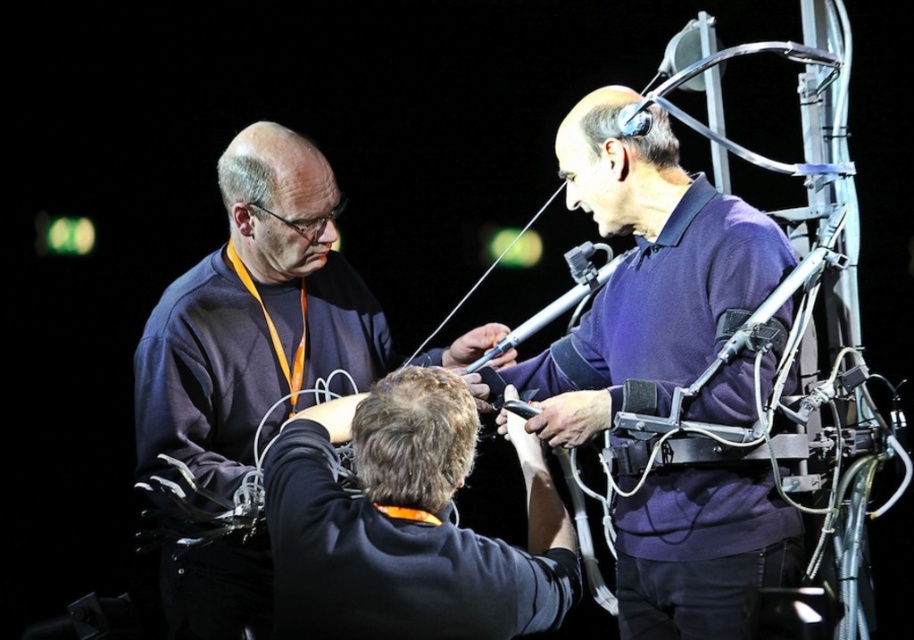
Question: Is purple matte shirt at center to the right of black matte jacket at center from the viewer's perspective?

Choices:
 (A) no
 (B) yes

Answer: (B)

Question: Does purple matte shirt at center appear over black matte jacket at center?

Choices:
 (A) yes
 (B) no

Answer: (A)

Question: Which object is closer to the camera taking this photo?

Choices:
 (A) purple matte shirt at center
 (B) black matte jacket at center

Answer: (B)

Question: Based on their relative distances, which object is nearer to the black matte jacket at center?

Choices:
 (A) purple matte shirt at center
 (B) dark blue sweatshirt at center

Answer: (A)

Question: Can you confirm if purple matte shirt at center is wider than dark blue sweatshirt at center?

Choices:
 (A) no
 (B) yes

Answer: (A)

Question: Which object is the closest to the black matte jacket at center?

Choices:
 (A) purple matte shirt at center
 (B) dark blue sweatshirt at center

Answer: (A)